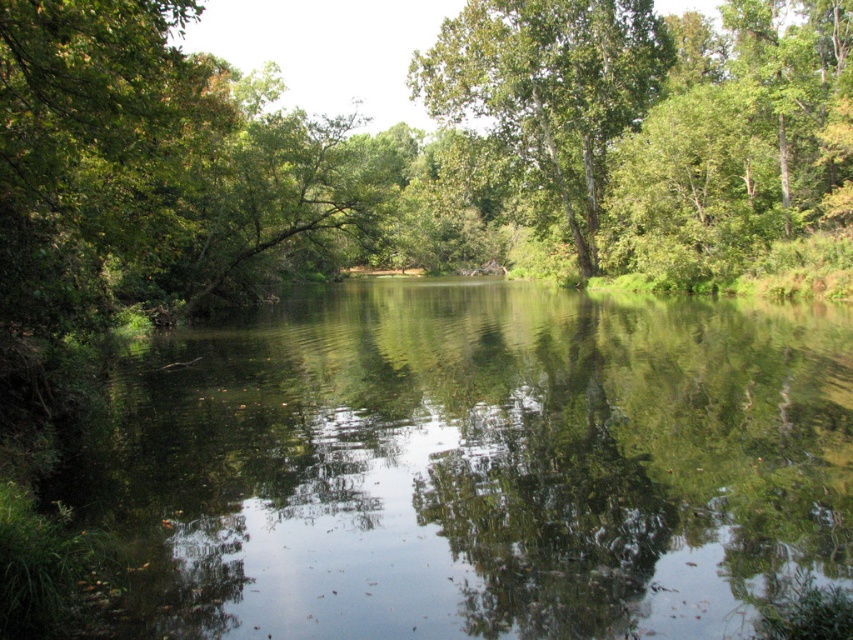
You are standing at the edge of the scene and want to take a photo of the green leafy tree at center and its reflection in the green reflective water at center. Which object should you focus on first to capture both the tree and its reflection clearly?

You should focus on the green leafy tree at center first because the green reflective water at center is located below it, allowing you to capture both the tree and its reflection by focusing on the tree.

You are standing at the edge of the water and want to take a photo of the green leafy tree at center without the green reflective water at center appearing in the foreground. Is this possible given their positions?

The green reflective water at center is closer to the viewer than the green leafy tree at center, so it will block the view of the tree. Therefore, it is not possible to take a photo of the green leafy tree at center without the green reflective water at center appearing in the foreground.